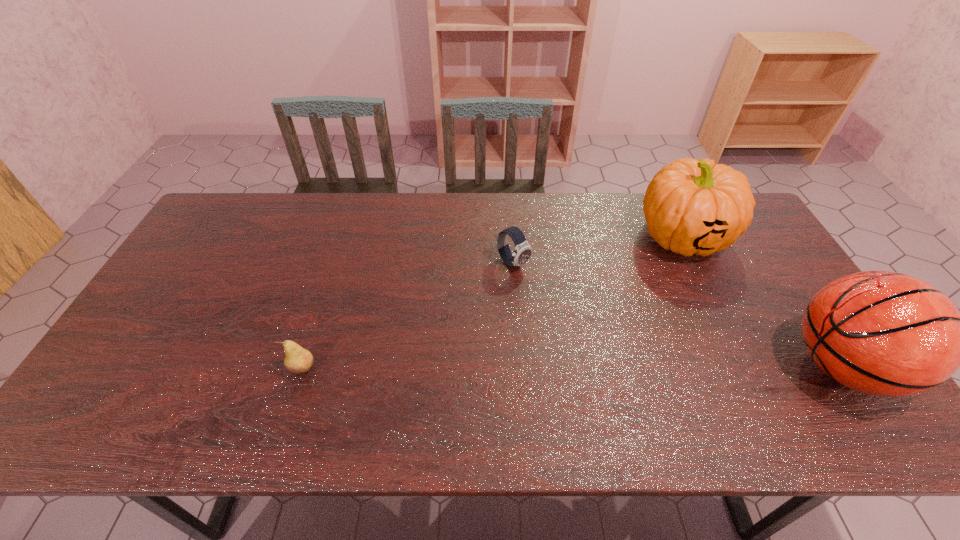
Where is `object that is at the near right corner`? The height and width of the screenshot is (540, 960). object that is at the near right corner is located at coordinates (883, 333).

What are the coordinates of `free space at the far edge of the desktop` in the screenshot? It's located at (483, 206).

The width and height of the screenshot is (960, 540). What are the coordinates of `free space at the near edge of the desktop` in the screenshot? It's located at (751, 394).

This screenshot has height=540, width=960. In the image, there is a desktop. Find the location of `vacant space at the far left corner`. vacant space at the far left corner is located at coordinates (251, 235).

Locate an element on the screen. This screenshot has height=540, width=960. empty space that is in between the leftmost object and the pumpkin is located at coordinates (492, 302).

You are a GUI agent. You are given a task and a screenshot of the screen. Output one action in this format:
    pyautogui.click(x=<x>, y=<y>)
    Task: Click on the unoccupied position between the pear and the basketball
    
    Given the screenshot: What is the action you would take?
    pyautogui.click(x=572, y=368)

Identify the location of vacant point located between the watch and the basketball. The height and width of the screenshot is (540, 960). (678, 315).

I want to click on unoccupied position between the pear and the pumpkin, so click(492, 302).

Find the location of `vacant space that's between the basketball and the pumpkin`. vacant space that's between the basketball and the pumpkin is located at coordinates (762, 301).

At what (x,y) coordinates should I click in order to perform the action: click on free space between the pear and the basketball. Please return your answer as a coordinate pair (x, y). The image size is (960, 540). Looking at the image, I should click on (572, 368).